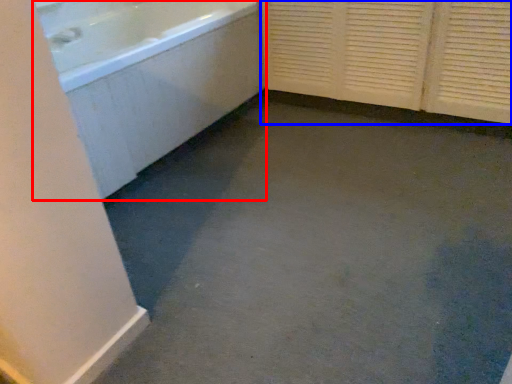
Question: Which point is closer to the camera, bathtub (highlighted by a red box) or screen door (highlighted by a blue box)?

Choices:
 (A) bathtub
 (B) screen door

Answer: (A)